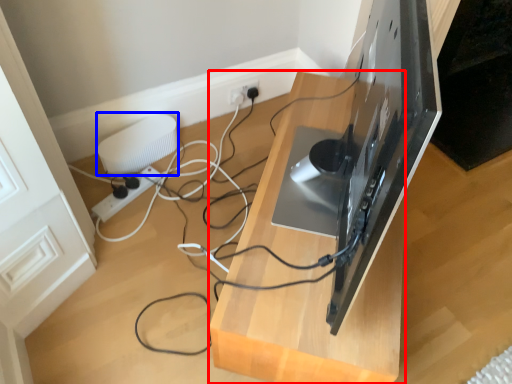
Question: Which point is closer to the camera, furniture (highlighted by a red box) or appliance (highlighted by a blue box)?

Choices:
 (A) furniture
 (B) appliance

Answer: (A)